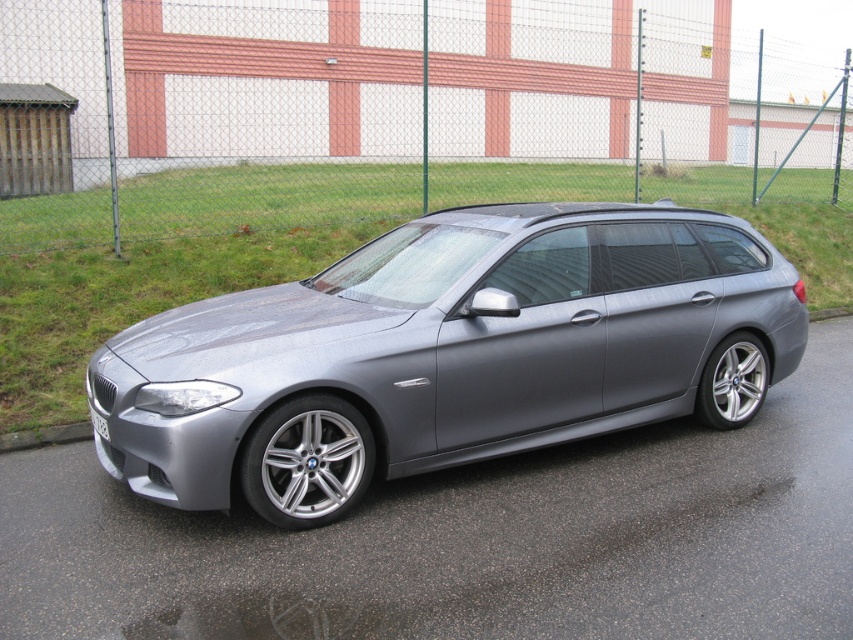
You are a delivery person who needs to attach a GPS tracker to the matte gray car at center. The GPS tracker must be placed exactly 2 meters away from the white plastic license plate at center. Is this possible?

The matte gray car at center and white plastic license plate at center are 2.28 meters apart from each other. Since the required distance is 2 meters, which is less than 2.28 meters, it is possible to place the GPS tracker 2 meters away from the white plastic license plate at center while still being on the matte gray car at center.

You are a photographer standing in front of the matte gray car at center and the white plastic license plate at center. You want to take a photo that captures both objects clearly. Which object should you focus on to ensure both are in sharp focus?

You should focus on the matte gray car at center because it is closer to the viewer than the white plastic license plate at center. By focusing on the closer object, the depth of field may extend to include the license plate in focus as well.